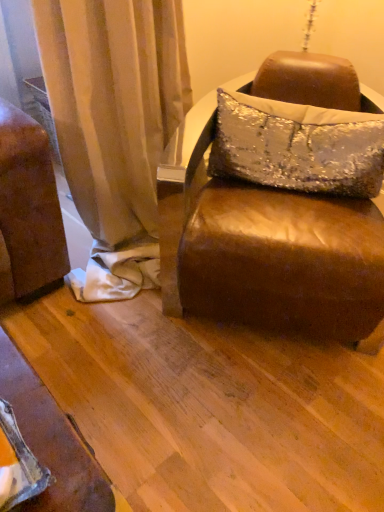
Question: Considering the positions of silver sequined pillow at center and brown leather ottoman at center in the image, is silver sequined pillow at center wider or thinner than brown leather ottoman at center?

Choices:
 (A) thin
 (B) wide

Answer: (A)

Question: From the image's perspective, is silver sequined pillow at center located above or below brown leather ottoman at center?

Choices:
 (A) above
 (B) below

Answer: (A)

Question: From a real-world perspective, is silver sequined pillow at center positioned above or below brown leather ottoman at center?

Choices:
 (A) below
 (B) above

Answer: (B)

Question: Would you say brown leather ottoman at center is inside or outside silver sequined pillow at center?

Choices:
 (A) outside
 (B) inside

Answer: (A)

Question: From a real-world perspective, relative to silver sequined pillow at center, is brown leather ottoman at center vertically above or below?

Choices:
 (A) below
 (B) above

Answer: (A)

Question: Relative to silver sequined pillow at center, is brown leather ottoman at center in front or behind?

Choices:
 (A) front
 (B) behind

Answer: (A)

Question: From the image's perspective, is brown leather ottoman at center above or below silver sequined pillow at center?

Choices:
 (A) above
 (B) below

Answer: (B)